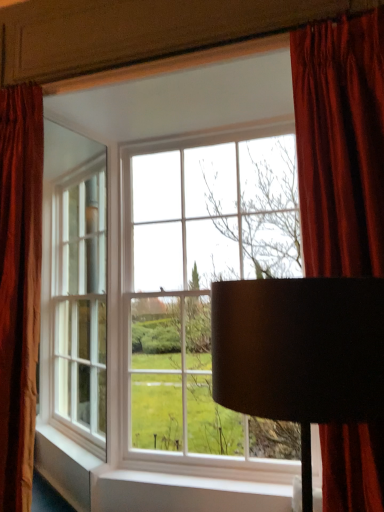
The height and width of the screenshot is (512, 384). Describe the element at coordinates (19, 286) in the screenshot. I see `velvet red curtain at left, the 2th curtain in the right-to-left sequence` at that location.

You are a GUI agent. You are given a task and a screenshot of the screen. Output one action in this format:
    pyautogui.click(x=<x>, y=<y>)
    Task: Click on the matte glass window at center
    This screenshot has width=384, height=512.
    Given the screenshot: What is the action you would take?
    pos(180,245)

Locate an element on the screen. The height and width of the screenshot is (512, 384). black matte lampshade at center is located at coordinates (300, 353).

The image size is (384, 512). Find the location of `velvet red curtain at upper right, marked as the 2th curtain in a left-to-right arrangement`. velvet red curtain at upper right, marked as the 2th curtain in a left-to-right arrangement is located at coordinates (340, 144).

Find the location of a particular element. The height and width of the screenshot is (512, 384). velvet red curtain at left, the 2th curtain in the right-to-left sequence is located at coordinates (19, 286).

Does point (7, 110) come in front of point (340, 46)?

No, (7, 110) is behind (340, 46).

From a real-world perspective, relative to velvet red curtain at upper right, marked as the 2th curtain in a left-to-right arrangement, is velvet red curtain at left, the 2th curtain in the right-to-left sequence, vertically above or below?

velvet red curtain at left, the 2th curtain in the right-to-left sequence, is situated lower than velvet red curtain at upper right, marked as the 2th curtain in a left-to-right arrangement, in the real world.

Between velvet red curtain at left, which is counted as the 1th curtain, starting from the left, and velvet red curtain at upper right, which is the first curtain from right to left, which one has larger size?

With larger size is velvet red curtain at upper right, which is the first curtain from right to left.

Considering the relative positions of velvet red curtain at left, the 2th curtain in the right-to-left sequence, and velvet red curtain at upper right, marked as the 2th curtain in a left-to-right arrangement, in the image provided, is velvet red curtain at left, the 2th curtain in the right-to-left sequence, to the left of velvet red curtain at upper right, marked as the 2th curtain in a left-to-right arrangement, from the viewer's perspective?

Yes.

Is black matte lampshade at center turned away from matte glass window at center?

No.

Which is in front, point (286, 333) or point (231, 90)?

The point (286, 333) is closer.

Which object is positioned more to the right, black matte lampshade at center or matte glass window at center?

black matte lampshade at center is more to the right.

Is point (334, 367) in front of point (344, 88)?

Yes.

Does black matte lampshade at center appear on the left side of velvet red curtain at upper right, which is the first curtain from right to left?

Yes, black matte lampshade at center is to the left of velvet red curtain at upper right, which is the first curtain from right to left.

Looking at their sizes, would you say black matte lampshade at center is wider or thinner than velvet red curtain at upper right, which is the first curtain from right to left?

black matte lampshade at center is wider than velvet red curtain at upper right, which is the first curtain from right to left.

Which object is closer to the camera taking this photo, black matte lampshade at center or velvet red curtain at upper right, marked as the 2th curtain in a left-to-right arrangement?

black matte lampshade at center is in front.

Is black matte lampshade at center positioned beyond the bounds of velvet red curtain at left, which is counted as the 1th curtain, starting from the left?

Yes, black matte lampshade at center is located beyond the bounds of velvet red curtain at left, which is counted as the 1th curtain, starting from the left.

Could you measure the distance between black matte lampshade at center and velvet red curtain at left, which is counted as the 1th curtain, starting from the left?

black matte lampshade at center is 4.34 feet from velvet red curtain at left, which is counted as the 1th curtain, starting from the left.

Does black matte lampshade at center have a larger size compared to velvet red curtain at left, which is counted as the 1th curtain, starting from the left?

Yes, black matte lampshade at center is bigger than velvet red curtain at left, which is counted as the 1th curtain, starting from the left.

Can you confirm if velvet red curtain at left, which is counted as the 1th curtain, starting from the left, is smaller than matte glass window at center?

Yes.

This screenshot has width=384, height=512. In the image, there is a velvet red curtain at left, which is counted as the 1th curtain, starting from the left. In order to click on window below it (from the image's perspective) in this screenshot , I will do `click(180, 245)`.

Can matte glass window at center be found inside velvet red curtain at left, which is counted as the 1th curtain, starting from the left?

No.

Is velvet red curtain at left, which is counted as the 1th curtain, starting from the left, next to matte glass window at center?

No, velvet red curtain at left, which is counted as the 1th curtain, starting from the left, is not beside matte glass window at center.

From the image's perspective, between matte glass window at center and velvet red curtain at upper right, which is the first curtain from right to left, who is located below?

matte glass window at center, from the image's perspective.

Is matte glass window at center not inside velvet red curtain at upper right, marked as the 2th curtain in a left-to-right arrangement?

That's correct, matte glass window at center is outside of velvet red curtain at upper right, marked as the 2th curtain in a left-to-right arrangement.

In terms of height, does matte glass window at center look taller or shorter compared to velvet red curtain at upper right, marked as the 2th curtain in a left-to-right arrangement?

In the image, matte glass window at center appears to be taller than velvet red curtain at upper right, marked as the 2th curtain in a left-to-right arrangement.

Considering the relative positions of matte glass window at center and velvet red curtain at upper right, marked as the 2th curtain in a left-to-right arrangement, in the image provided, is matte glass window at center to the right of velvet red curtain at upper right, marked as the 2th curtain in a left-to-right arrangement, from the viewer's perspective?

No, matte glass window at center is not to the right of velvet red curtain at upper right, marked as the 2th curtain in a left-to-right arrangement.

Considering the relative sizes of velvet red curtain at upper right, which is the first curtain from right to left, and matte glass window at center in the image provided, is velvet red curtain at upper right, which is the first curtain from right to left, thinner than matte glass window at center?

Correct, the width of velvet red curtain at upper right, which is the first curtain from right to left, is less than that of matte glass window at center.

What's the angular difference between velvet red curtain at upper right, which is the first curtain from right to left, and matte glass window at center's facing directions?

The facing directions of velvet red curtain at upper right, which is the first curtain from right to left, and matte glass window at center are 0.693 degrees apart.

Is velvet red curtain at upper right, marked as the 2th curtain in a left-to-right arrangement, spatially inside matte glass window at center, or outside of it?

velvet red curtain at upper right, marked as the 2th curtain in a left-to-right arrangement, cannot be found inside matte glass window at center.

Is velvet red curtain at upper right, which is the first curtain from right to left, oriented away from matte glass window at center?

Yes, velvet red curtain at upper right, which is the first curtain from right to left,'s orientation is away from matte glass window at center.

You are a GUI agent. You are given a task and a screenshot of the screen. Output one action in this format:
    pyautogui.click(x=<x>, y=<y>)
    Task: Click on the curtain that is on the left side of velvet red curtain at upper right, which is the first curtain from right to left
    The image size is (384, 512).
    Given the screenshot: What is the action you would take?
    pyautogui.click(x=19, y=286)

Locate an element on the screen. The width and height of the screenshot is (384, 512). table lamp lying on the right of matte glass window at center is located at coordinates (300, 353).

Based on their spatial positions, is matte glass window at center or velvet red curtain at left, which is counted as the 1th curtain, starting from the left, further from velvet red curtain at upper right, marked as the 2th curtain in a left-to-right arrangement?

velvet red curtain at left, which is counted as the 1th curtain, starting from the left, is positioned further to the anchor velvet red curtain at upper right, marked as the 2th curtain in a left-to-right arrangement.

Looking at the image, which one is located closer to velvet red curtain at upper right, marked as the 2th curtain in a left-to-right arrangement, black matte lampshade at center or velvet red curtain at left, which is counted as the 1th curtain, starting from the left?

black matte lampshade at center.

Based on their spatial positions, is matte glass window at center or velvet red curtain at left, which is counted as the 1th curtain, starting from the left, closer to black matte lampshade at center?

velvet red curtain at left, which is counted as the 1th curtain, starting from the left, is positioned closer to the anchor black matte lampshade at center.

When comparing their distances from matte glass window at center, does black matte lampshade at center or velvet red curtain at upper right, which is the first curtain from right to left, seem closer?

The object closer to matte glass window at center is velvet red curtain at upper right, which is the first curtain from right to left.

Looking at the image, which one is located further to velvet red curtain at left, the 2th curtain in the right-to-left sequence, matte glass window at center or black matte lampshade at center?

black matte lampshade at center is further to velvet red curtain at left, the 2th curtain in the right-to-left sequence.

In the scene shown: Based on their spatial positions, is velvet red curtain at left, which is counted as the 1th curtain, starting from the left, or velvet red curtain at upper right, which is the first curtain from right to left, closer to matte glass window at center?

velvet red curtain at left, which is counted as the 1th curtain, starting from the left, is closer to matte glass window at center.

From the image, which object appears to be farther from matte glass window at center, velvet red curtain at upper right, which is the first curtain from right to left, or black matte lampshade at center?

The object further to matte glass window at center is black matte lampshade at center.

Based on the photo, estimate the real-world distances between objects in this image. Which object is closer to black matte lampshade at center, velvet red curtain at upper right, marked as the 2th curtain in a left-to-right arrangement, or velvet red curtain at left, the 2th curtain in the right-to-left sequence?

The object closer to black matte lampshade at center is velvet red curtain at upper right, marked as the 2th curtain in a left-to-right arrangement.

At what (x,y) coordinates should I click in order to perform the action: click on window located between velvet red curtain at left, the 2th curtain in the right-to-left sequence, and velvet red curtain at upper right, which is the first curtain from right to left, in the left-right direction. Please return your answer as a coordinate pair (x, y). Looking at the image, I should click on (180, 245).

This screenshot has height=512, width=384. What are the coordinates of `window between velvet red curtain at left, the 2th curtain in the right-to-left sequence, and black matte lampshade at center` in the screenshot? It's located at (180, 245).

You are a GUI agent. You are given a task and a screenshot of the screen. Output one action in this format:
    pyautogui.click(x=<x>, y=<y>)
    Task: Click on the table lamp located between velvet red curtain at left, which is counted as the 1th curtain, starting from the left, and velvet red curtain at upper right, which is the first curtain from right to left, in the left-right direction
    
    Given the screenshot: What is the action you would take?
    pyautogui.click(x=300, y=353)

The image size is (384, 512). Identify the location of table lamp between matte glass window at center and velvet red curtain at upper right, marked as the 2th curtain in a left-to-right arrangement, in the horizontal direction. (300, 353).